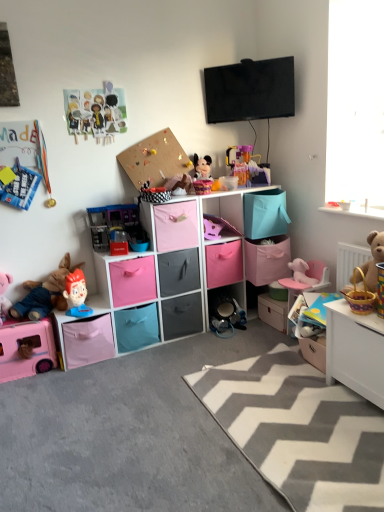
Question: Should I look upward or downward to see translucent plastic playset at center, the third toy viewed from the right?

Choices:
 (A) down
 (B) up

Answer: (B)

Question: Which direction should I rotate to look at pink fabric drawer at center, the second drawer positioned from the left, — up or down?

Choices:
 (A) up
 (B) down

Answer: (B)

Question: From the image's perspective, is matte black drawer at center, the third drawer positioned from the left, on top of plastic play kitchen at center, which appears as the 6th toy when viewed from the right?

Choices:
 (A) yes
 (B) no

Answer: (B)

Question: Does matte black drawer at center, the third drawer positioned from the left, have a lesser height compared to plastic play kitchen at center, which is the 5th toy from left to right?

Choices:
 (A) no
 (B) yes

Answer: (A)

Question: Is the position of matte black drawer at center, the third drawer positioned from the left, less distant than that of plastic play kitchen at center, which is the 5th toy from left to right?

Choices:
 (A) no
 (B) yes

Answer: (A)

Question: Can you confirm if matte black drawer at center, the fourth drawer positioned from the right, is taller than plastic play kitchen at center, which is the 5th toy from left to right?

Choices:
 (A) yes
 (B) no

Answer: (A)

Question: Considering the relative sizes of matte black drawer at center, the third drawer positioned from the left, and plastic play kitchen at center, which is the 5th toy from left to right, in the image provided, is matte black drawer at center, the third drawer positioned from the left, thinner than plastic play kitchen at center, which is the 5th toy from left to right,?

Choices:
 (A) yes
 (B) no

Answer: (B)

Question: Can you confirm if matte black drawer at center, the fourth drawer positioned from the right, is bigger than plastic play kitchen at center, which appears as the 6th toy when viewed from the right?

Choices:
 (A) yes
 (B) no

Answer: (A)

Question: Does pink fabric storage cube at center, which appears as the 2th cabinet when ordered from the bottom, have a greater height compared to translucent plastic playset at center, marked as the 8th toy in a left-to-right arrangement?

Choices:
 (A) no
 (B) yes

Answer: (B)

Question: From the image's perspective, is pink fabric storage cube at center, which appears as the 2th cabinet when ordered from the bottom, below translucent plastic playset at center, the third toy viewed from the right?

Choices:
 (A) no
 (B) yes

Answer: (B)

Question: Could you tell me if pink fabric storage cube at center, positioned as the second cabinet in top-to-bottom order, is facing translucent plastic playset at center, the third toy viewed from the right?

Choices:
 (A) yes
 (B) no

Answer: (B)

Question: Is pink fabric storage cube at center, which appears as the 2th cabinet when ordered from the bottom, to the right of translucent plastic playset at center, marked as the 8th toy in a left-to-right arrangement, from the viewer's perspective?

Choices:
 (A) yes
 (B) no

Answer: (B)

Question: Is pink fabric storage cube at center, which appears as the 2th cabinet when ordered from the bottom, oriented away from translucent plastic playset at center, the third toy viewed from the right?

Choices:
 (A) yes
 (B) no

Answer: (B)

Question: Considering the relative sizes of pink fabric storage cube at center, which appears as the 2th cabinet when ordered from the bottom, and translucent plastic playset at center, marked as the 8th toy in a left-to-right arrangement, in the image provided, is pink fabric storage cube at center, which appears as the 2th cabinet when ordered from the bottom, shorter than translucent plastic playset at center, marked as the 8th toy in a left-to-right arrangement,?

Choices:
 (A) yes
 (B) no

Answer: (B)

Question: Is matte paper dolls at upper left, the 7th toy from the right, thinner than pink fabric cabinet at center, the 3th cabinet ordered from the bottom?

Choices:
 (A) yes
 (B) no

Answer: (A)